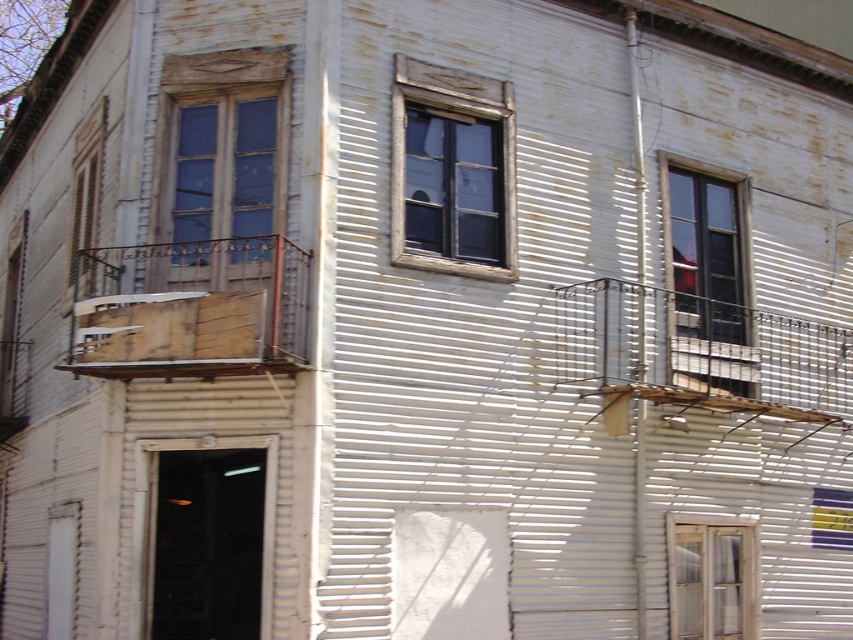
Between wooden frame at upper left and wooden frame at center, which one is positioned lower?

wooden frame at upper left is below.

Is wooden frame at upper left positioned in front of wooden frame at center?

Yes.

Does point (253, 196) come closer to viewer compared to point (474, 256)?

Yes, point (253, 196) is closer to viewer.

Find the location of a particular element. wooden frame at upper left is located at coordinates (221, 170).

Can you confirm if wooden frame at center is shorter than matte glass window at upper right?

Correct, wooden frame at center is not as tall as matte glass window at upper right.

Is wooden frame at center smaller than matte glass window at upper right?

Correct, wooden frame at center occupies less space than matte glass window at upper right.

Locate an element on the screen. This screenshot has width=853, height=640. wooden frame at center is located at coordinates (451, 172).

Where is `wooden frame at center`? The height and width of the screenshot is (640, 853). wooden frame at center is located at coordinates (451, 172).

Which of these two, wooden frame at upper left or matte glass window at upper right, stands shorter?

Standing shorter between the two is wooden frame at upper left.

Can you confirm if wooden frame at upper left is positioned above matte glass window at upper right?

Correct, wooden frame at upper left is located above matte glass window at upper right.

Find the location of a particular element. Image resolution: width=853 pixels, height=640 pixels. wooden frame at upper left is located at coordinates (221, 170).